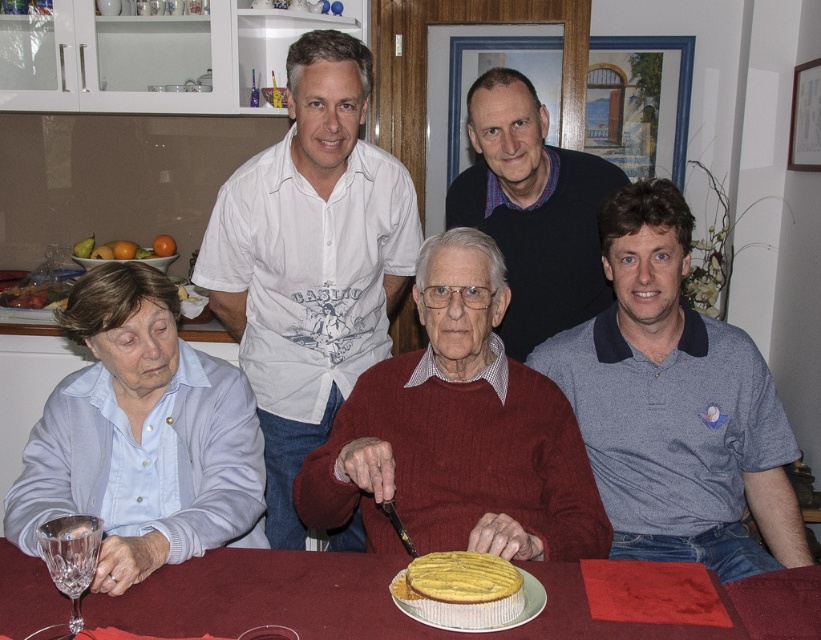
Can you confirm if gray cotton polo shirt at right is positioned below dark blue sweater at upper center?

Yes, gray cotton polo shirt at right is below dark blue sweater at upper center.

Which of these two, gray cotton polo shirt at right or dark blue sweater at upper center, stands taller?

With more height is gray cotton polo shirt at right.

Who is more forward, (x=753, y=371) or (x=590, y=262)?

Positioned in front is point (x=753, y=371).

Find the location of a particular element. The height and width of the screenshot is (640, 821). gray cotton polo shirt at right is located at coordinates (675, 404).

Between maroon sweater at center and dark blue sweater at upper center, which one has less height?

maroon sweater at center is shorter.

The image size is (821, 640). I want to click on maroon sweater at center, so click(x=457, y=435).

Does point (303, 436) come closer to viewer compared to point (441, 333)?

No, it is behind (441, 333).

Can you confirm if white cotton shirt at upper center is shorter than maroon sweater at center?

Incorrect, white cotton shirt at upper center's height does not fall short of maroon sweater at center's.

Locate an element on the screen. Image resolution: width=821 pixels, height=640 pixels. white cotton shirt at upper center is located at coordinates (310, 260).